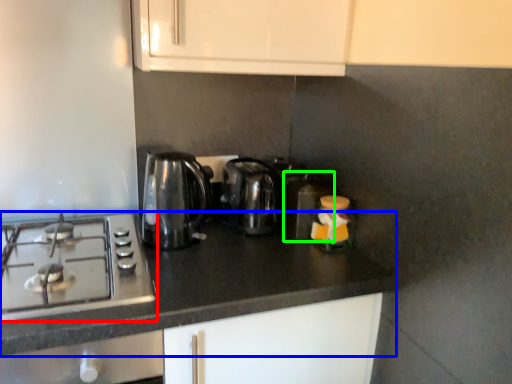
Question: Which object is positioned farthest from gas stove (highlighted by a red box)? Select from countertop (highlighted by a blue box) and appliance (highlighted by a green box).

Choices:
 (A) countertop
 (B) appliance

Answer: (B)